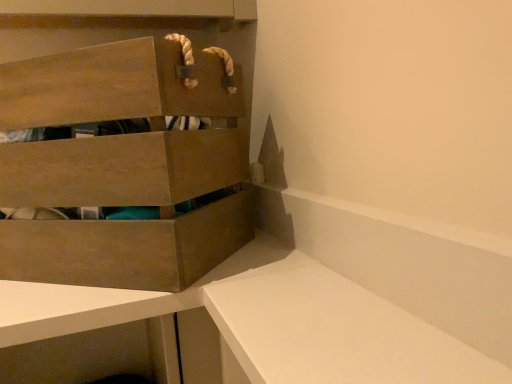
Image resolution: width=512 pixels, height=384 pixels. I want to click on vacant area on top of white matte vanity at lower right (from a real-world perspective), so click(x=347, y=200).